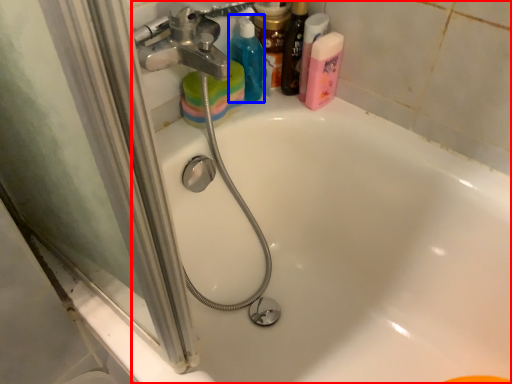
Question: Which point is closer to the camera, bathtub (highlighted by a red box) or cleaning product (highlighted by a blue box)?

Choices:
 (A) bathtub
 (B) cleaning product

Answer: (A)